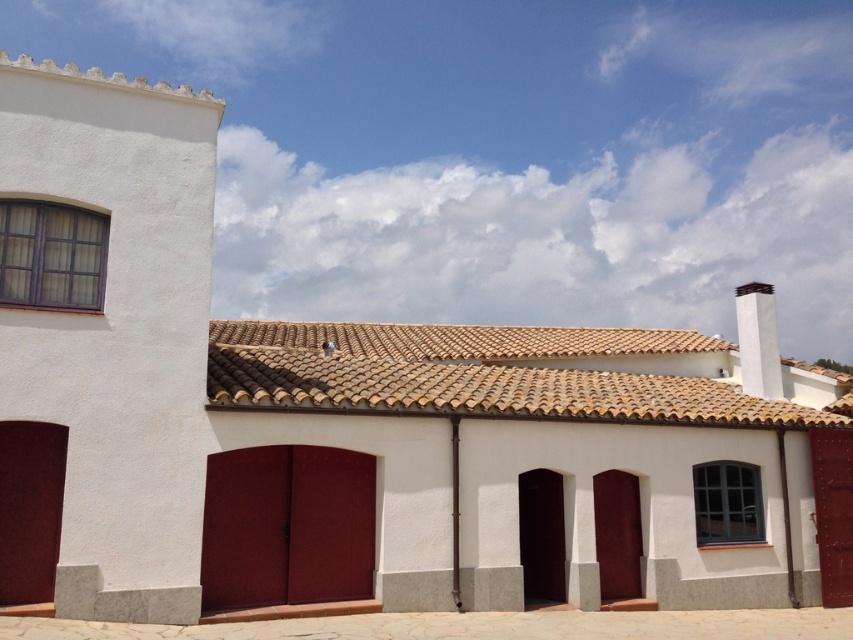
Question: Does burgundy matte/glossy garage door at center have a lesser width compared to white smooth chimney at upper right?

Choices:
 (A) no
 (B) yes

Answer: (B)

Question: Does brown clay tiles at center lie in front of white smooth chimney at upper right?

Choices:
 (A) yes
 (B) no

Answer: (A)

Question: Which point is farther to the camera?

Choices:
 (A) (299, 556)
 (B) (491, 401)
 (C) (753, 337)

Answer: (C)

Question: Among these points, which one is nearest to the camera?

Choices:
 (A) (775, 369)
 (B) (367, 408)

Answer: (B)

Question: Which point is farther from the camera taking this photo?

Choices:
 (A) (339, 547)
 (B) (776, 369)

Answer: (B)

Question: Is burgundy matte/glossy garage door at center wider than white smooth chimney at upper right?

Choices:
 (A) no
 (B) yes

Answer: (A)